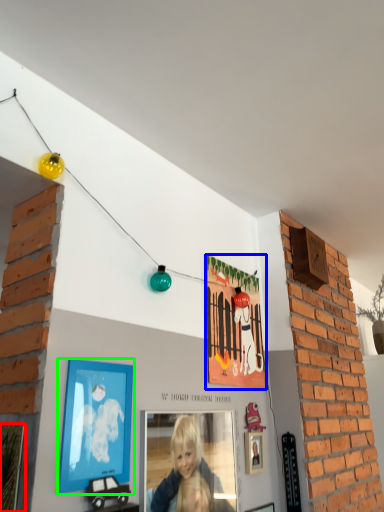
Question: Which is farther away from picture frame (highlighted by a red box)? picture frame (highlighted by a blue box) or picture frame (highlighted by a green box)?

Choices:
 (A) picture frame
 (B) picture frame

Answer: (A)